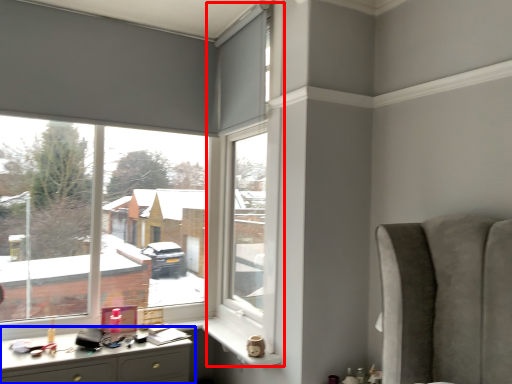
Question: Which point is closer to the camera, window frame (highlighted by a red box) or desk (highlighted by a blue box)?

Choices:
 (A) window frame
 (B) desk

Answer: (B)